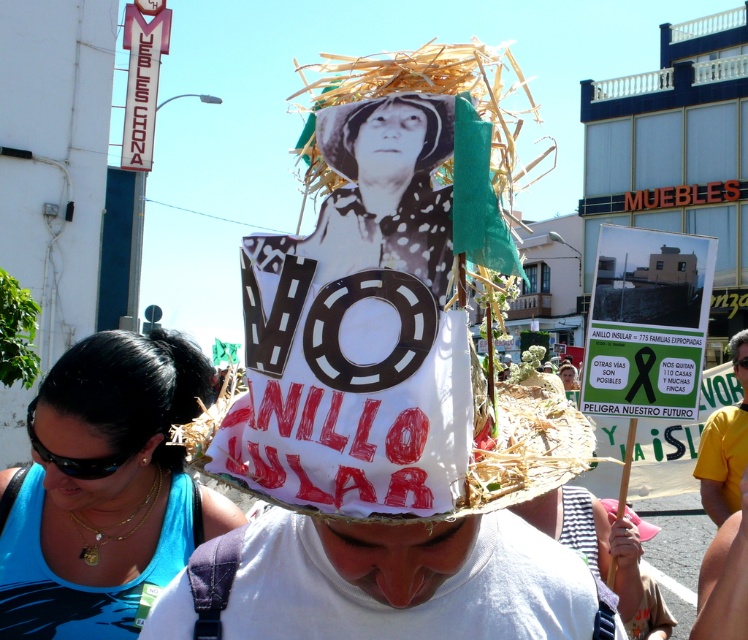
Question: Among these objects, which one is nearest to the camera?

Choices:
 (A) black plastic goggles at lower left
 (B) shiny gold sunglasses at lower center
 (C) yellow fabric shirt at center
 (D) black hair at center

Answer: (D)

Question: Which object appears farthest from the camera in this image?

Choices:
 (A) black plastic goggles at lower left
 (B) shiny gold sunglasses at lower center
 (C) black hair at center

Answer: (B)

Question: Does black hair at center appear over yellow fabric shirt at center?

Choices:
 (A) no
 (B) yes

Answer: (B)

Question: Is yellow fabric shirt at center positioned at the back of shiny gold sunglasses at lower center?

Choices:
 (A) no
 (B) yes

Answer: (A)

Question: Which object is farther from the camera taking this photo?

Choices:
 (A) blue fabric at lower left
 (B) yellow fabric shirt at center

Answer: (B)

Question: Can you confirm if blue fabric at lower left is smaller than shiny gold sunglasses at lower center?

Choices:
 (A) no
 (B) yes

Answer: (B)